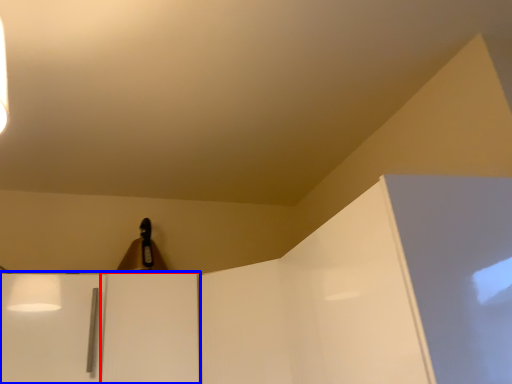
Question: Which object appears closest to the camera in this image, door (highlighted by a red box) or cabinetry (highlighted by a blue box)?

Choices:
 (A) door
 (B) cabinetry

Answer: (B)